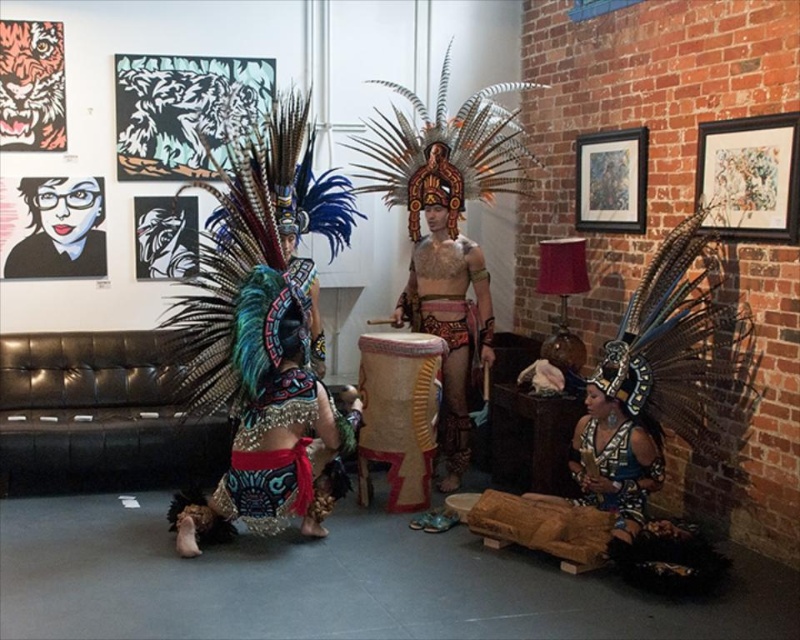
Question: Which point is closer to the camera taking this photo?

Choices:
 (A) (586, 476)
 (B) (432, 305)
 (C) (428, 300)

Answer: (A)

Question: Can you confirm if shiny gold headdress at center is positioned above matte black headdress at lower right?

Choices:
 (A) yes
 (B) no

Answer: (A)

Question: Which of the following is the farthest from the observer?

Choices:
 (A) (640, 484)
 (B) (622, 416)
 (C) (169, 200)
 (D) (286, 492)

Answer: (C)

Question: Can you confirm if shiny metallic skirt at center is positioned to the right of black paper mask at center?

Choices:
 (A) yes
 (B) no

Answer: (A)

Question: Which of the following is the closest to the observer?

Choices:
 (A) (245, 419)
 (B) (640, 508)

Answer: (B)

Question: Does shiny gold headdress at center have a greater width compared to shiny blue fabric headdress at lower right?

Choices:
 (A) yes
 (B) no

Answer: (A)